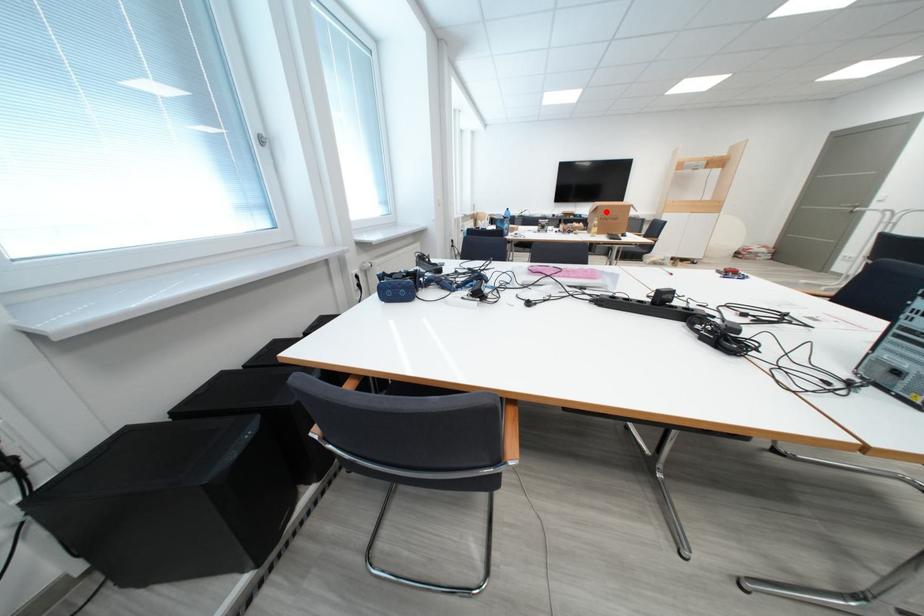
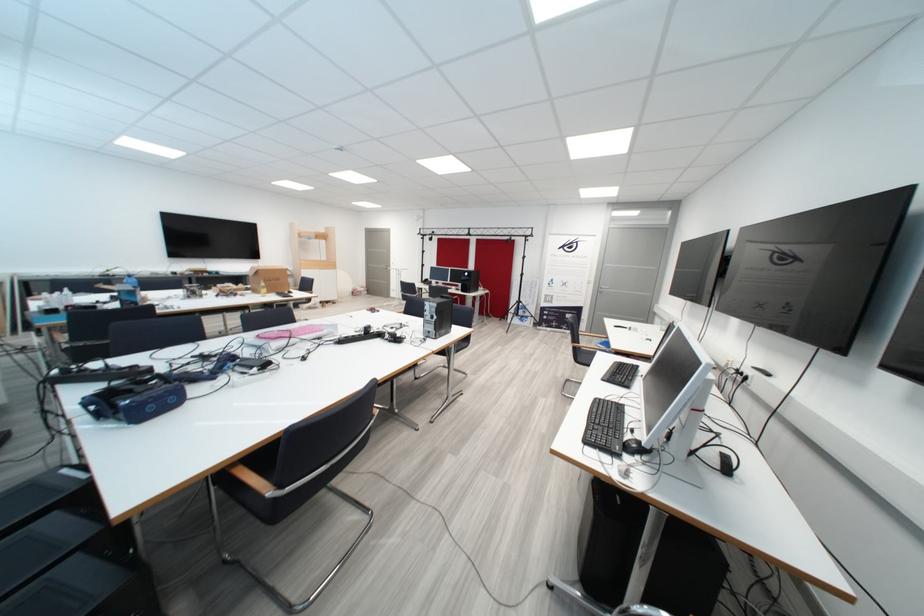
Question: I am providing you with two images of the same scene from different viewpoints. Image1 has a red point marked. In image2, the corresponding 3D location appears at what relative position? Reply with the corresponding letter.

Choices:
 (A) Closer
 (B) Farther

Answer: (A)